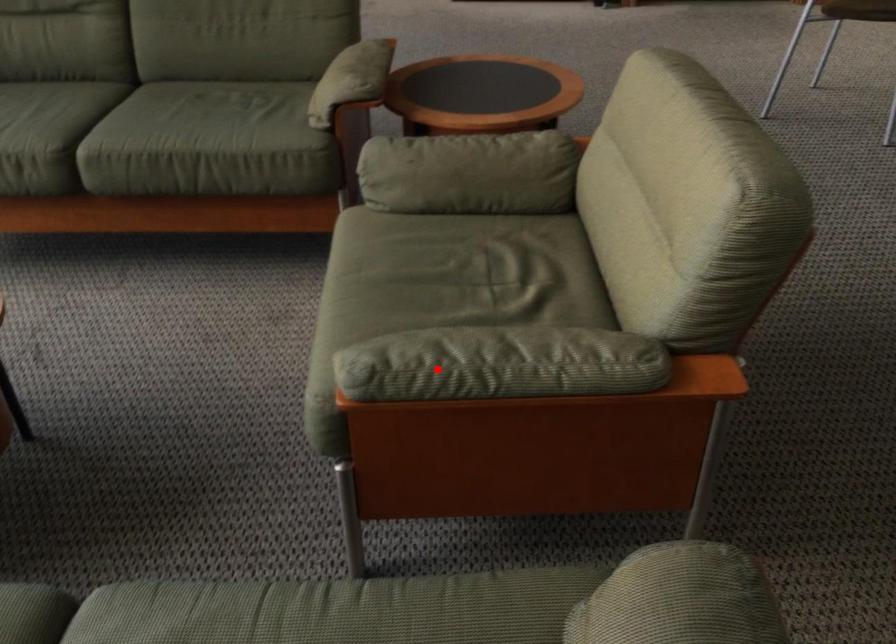
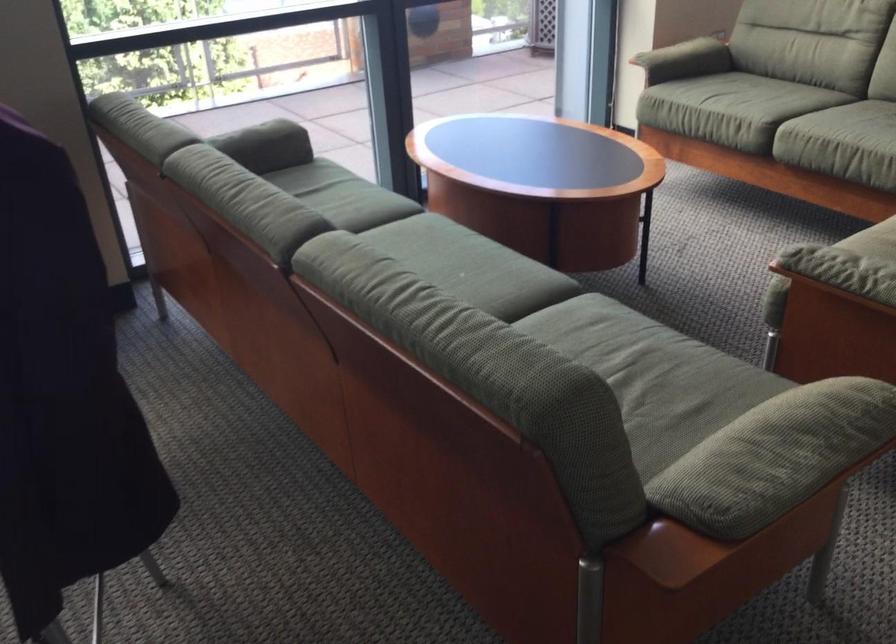
Where in the second image is the point corresponding to the highlighted location from the first image?

(834, 263)